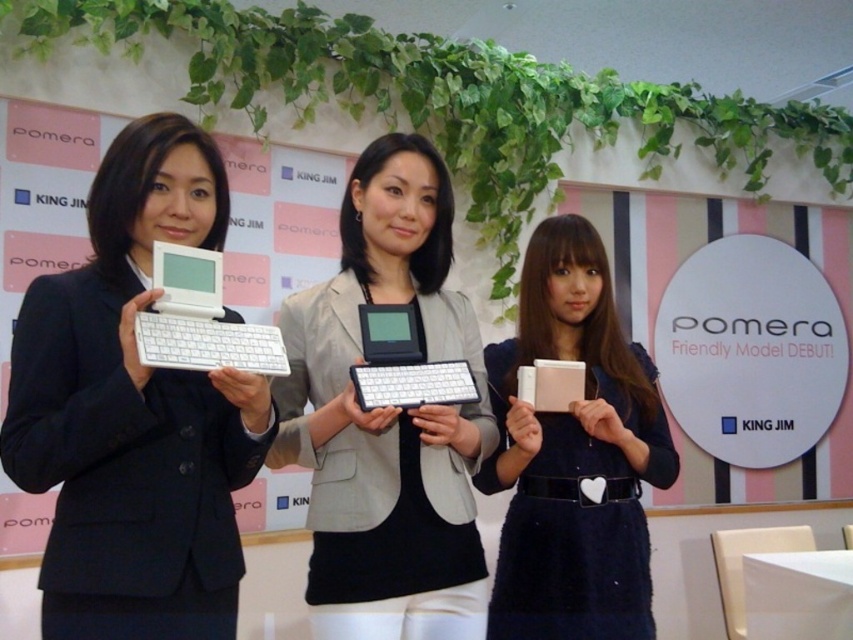
Does pink fabric purse at center come behind white matte laptop at left?

Yes.

This screenshot has height=640, width=853. Find the location of `pink fabric purse at center`. pink fabric purse at center is located at coordinates (573, 454).

Measure the distance between pink fabric purse at center and camera.

A distance of 5.16 feet exists between pink fabric purse at center and camera.

Where is `pink fabric purse at center`? The height and width of the screenshot is (640, 853). pink fabric purse at center is located at coordinates (573, 454).

Is matte black laptop at left thinner than matte black device at center?

Yes, matte black laptop at left is thinner than matte black device at center.

Is matte black laptop at left to the right of matte black device at center from the viewer's perspective?

In fact, matte black laptop at left is to the left of matte black device at center.

Locate an element on the screen. The width and height of the screenshot is (853, 640). matte black laptop at left is located at coordinates (132, 412).

You are a GUI agent. You are given a task and a screenshot of the screen. Output one action in this format:
    pyautogui.click(x=<x>, y=<y>)
    Task: Click on the matte black laptop at left
    
    Given the screenshot: What is the action you would take?
    pyautogui.click(x=132, y=412)

Is point (141, 428) farther from camera compared to point (407, 340)?

No.

I want to click on matte black laptop at left, so click(132, 412).